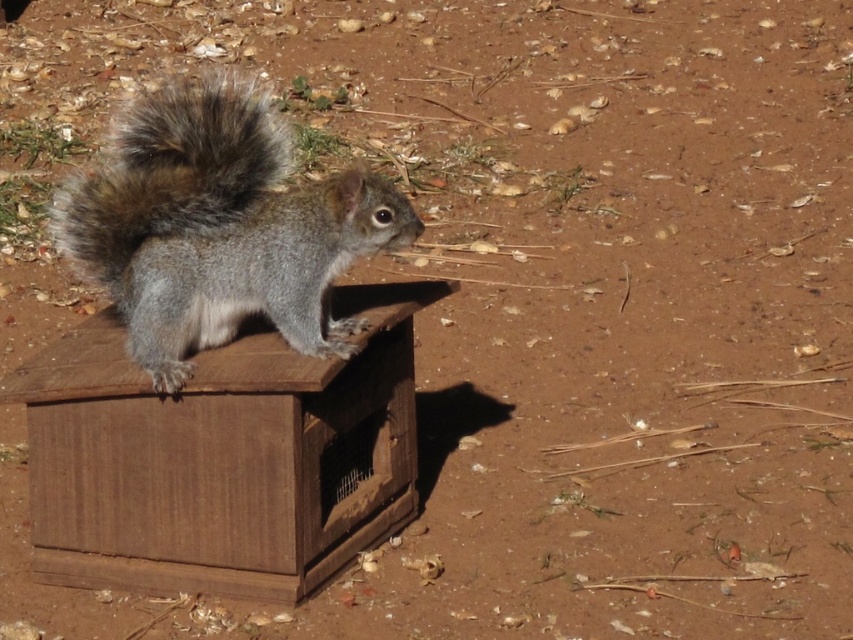
Question: Which point is farther from the camera taking this photo?

Choices:
 (A) (271, 464)
 (B) (254, 154)
 (C) (189, 371)

Answer: (C)

Question: Is gray furry squirrel on the left thinner than fuzzy fur tail at upper center?

Choices:
 (A) no
 (B) yes

Answer: (B)

Question: Among these objects, which one is farthest from the camera?

Choices:
 (A) gray furry squirrel on the left
 (B) wooden crate at center
 (C) fuzzy fur tail at upper center

Answer: (C)

Question: Is gray furry squirrel on the left further to camera compared to fuzzy fur tail at upper center?

Choices:
 (A) no
 (B) yes

Answer: (A)

Question: Does wooden crate at center have a greater width compared to fuzzy fur tail at upper center?

Choices:
 (A) yes
 (B) no

Answer: (A)

Question: Which point is closer to the camera taking this photo?

Choices:
 (A) (254, 588)
 (B) (331, 282)

Answer: (B)